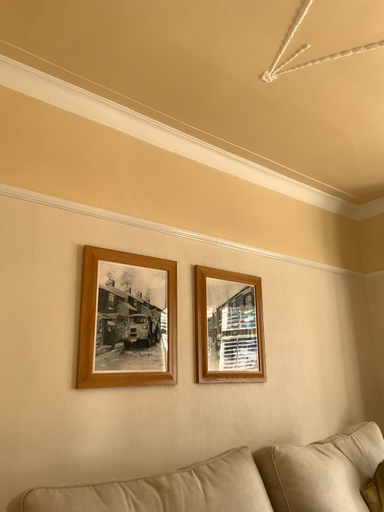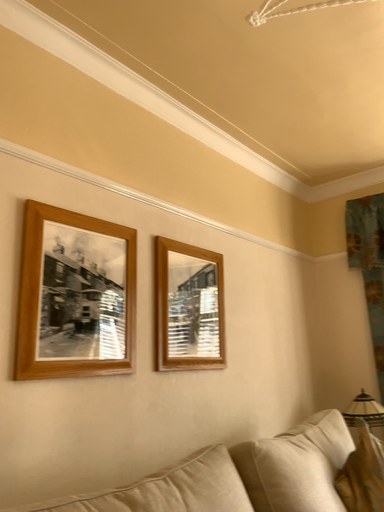
Question: How did the camera likely rotate when shooting the video?

Choices:
 (A) rotated right
 (B) rotated left

Answer: (A)